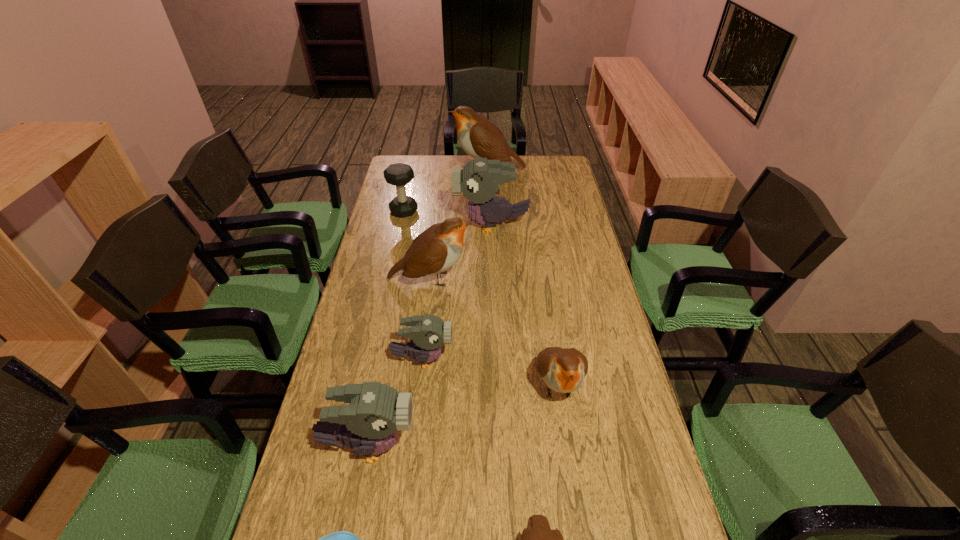
In order to click on the farthest object in this screenshot , I will do `click(479, 138)`.

The height and width of the screenshot is (540, 960). What are the coordinates of `the biggest brown bird` in the screenshot? It's located at (479, 138).

What are the coordinates of `the farthest gray bird` in the screenshot? It's located at (478, 180).

Locate an element on the screen. The width and height of the screenshot is (960, 540). the biggest gray bird is located at coordinates (478, 180).

At what (x,y) coordinates should I click in order to perform the action: click on the fourth farthest object. Please return your answer as a coordinate pair (x, y). The height and width of the screenshot is (540, 960). Looking at the image, I should click on (435, 250).

I want to click on the second biggest brown bird, so click(x=435, y=250).

Identify the location of the third nearest object. This screenshot has height=540, width=960. (369, 423).

The width and height of the screenshot is (960, 540). I want to click on the second smallest gray bird, so click(369, 423).

Find the location of a particular element. The image size is (960, 540). the third farthest brown bird is located at coordinates (563, 370).

Identify the location of gray dumbbell. (399, 174).